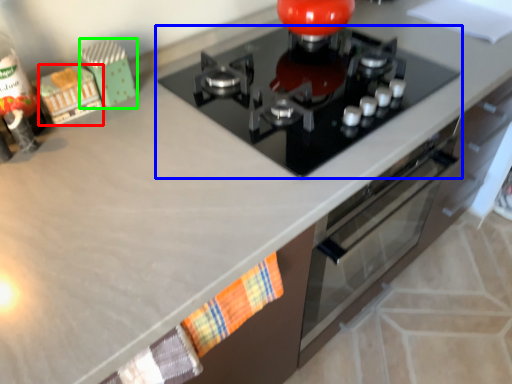
Question: Which object is the closest to the toy (highlighted by a red box)? Choose among these: gas stove (highlighted by a blue box) or toy (highlighted by a green box).

Choices:
 (A) gas stove
 (B) toy

Answer: (B)